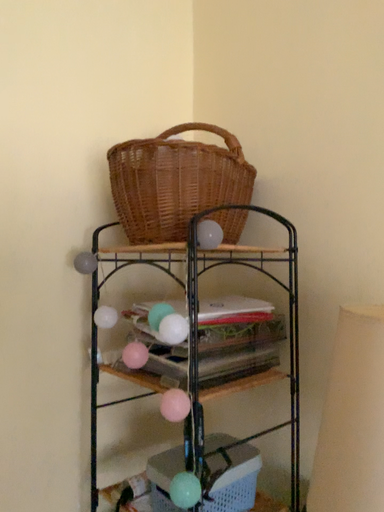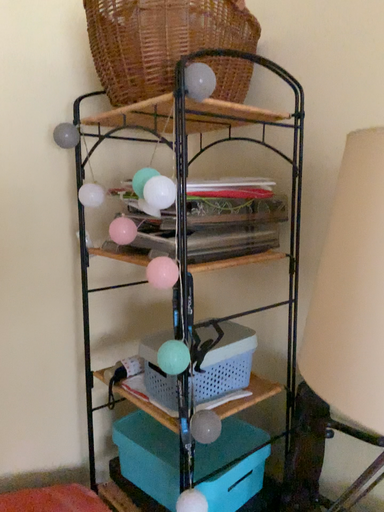
Question: How did the camera likely rotate when shooting the video?

Choices:
 (A) rotated downward
 (B) rotated upward

Answer: (A)